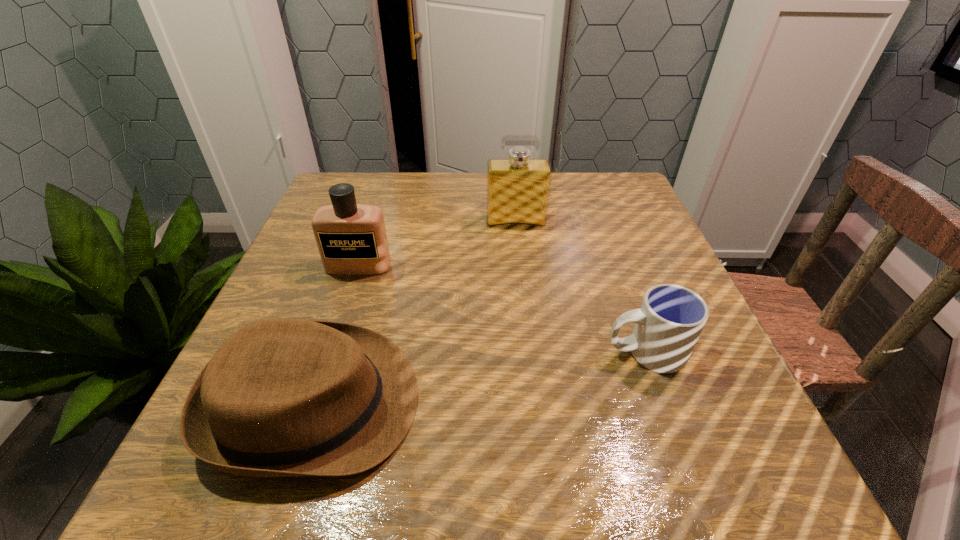
What are the coordinates of `blank area at the right edge` in the screenshot? It's located at (642, 242).

Where is `free space at the far left corner of the desktop`? free space at the far left corner of the desktop is located at coordinates (329, 187).

In the image, there is a desktop. At what (x,y) coordinates should I click in order to perform the action: click on vacant space at the far right corner. Please return your answer as a coordinate pair (x, y). The image size is (960, 540). Looking at the image, I should click on (582, 212).

You are a GUI agent. You are given a task and a screenshot of the screen. Output one action in this format:
    pyautogui.click(x=<x>, y=<y>)
    Task: Click on the free space at the near right corner
    
    Given the screenshot: What is the action you would take?
    pyautogui.click(x=695, y=491)

This screenshot has height=540, width=960. Identify the location of unoccupied position between the fedora and the farthest object. (415, 312).

Image resolution: width=960 pixels, height=540 pixels. I want to click on vacant space that's between the fedora and the farther perfume, so click(x=415, y=312).

I want to click on free space between the rightmost object and the nearer perfume, so click(x=502, y=308).

Find the location of `empty space that is in between the fedora and the right perfume`. empty space that is in between the fedora and the right perfume is located at coordinates tap(415, 312).

Image resolution: width=960 pixels, height=540 pixels. I want to click on free space between the right perfume and the third nearest object, so click(x=437, y=244).

Where is `vacant space that's between the right perfume and the fedora`? This screenshot has width=960, height=540. vacant space that's between the right perfume and the fedora is located at coordinates (415, 312).